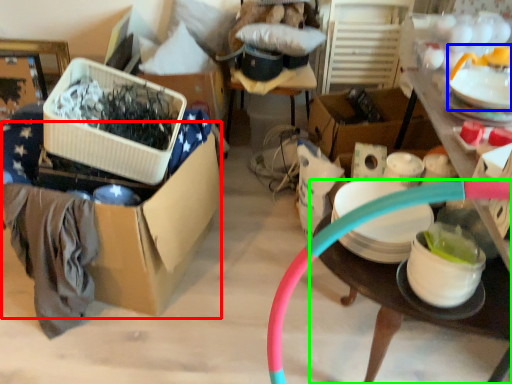
Question: Which object is positioned farthest from storage box (highlighted by a red box)? Select from tableware (highlighted by a blue box) and table (highlighted by a green box).

Choices:
 (A) tableware
 (B) table

Answer: (A)